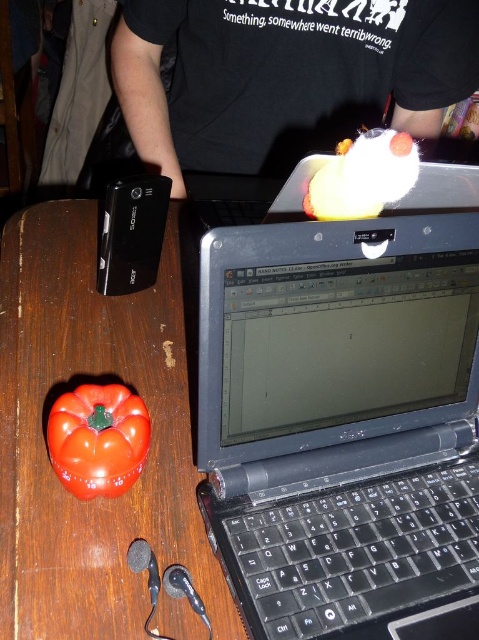
You are an office worker who wants to see both the black cotton shirt at upper center and the white fluffy cloud at upper center in the same view. Since you can only move your head slightly, which direction should you turn your head to ensure both are visible?

You should turn your head to the right because the black cotton shirt at upper center is to the left of the white fluffy cloud at upper center, so moving your head right will keep both in view.

You are setting up a new monitor on the table and need to place it in the position of point (291, 99) or point (403, 156). Which point is closer to the edge of the table?

Point (403, 156) is closer to the edge of the table because it is in front of point (291, 99), which is further back.

You are setting up a new monitor stand for your workspace. You have two items on your desk, the black plastic laptop at upper center and the white fluffy cloud at upper center. Which item needs to be lowered more to ensure both are at the same height?

The black plastic laptop at upper center needs to be lowered more because it has a greater height compared to the white fluffy cloud at upper center.